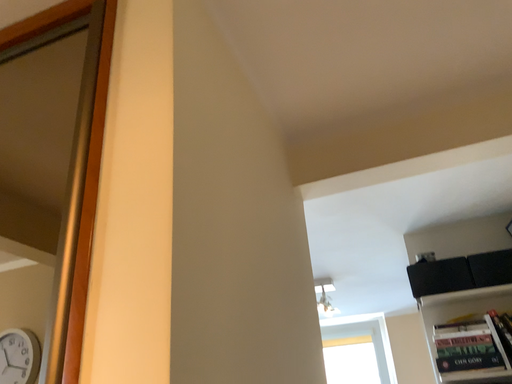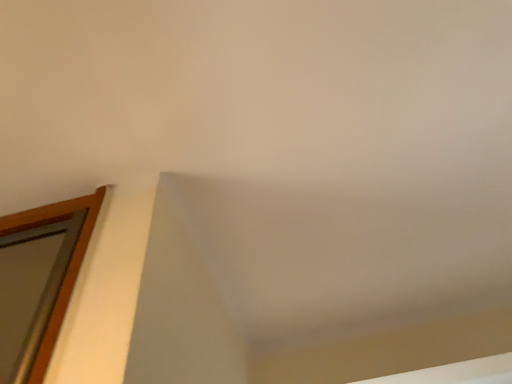
Question: Which way did the camera rotate in the video?

Choices:
 (A) rotated downward
 (B) rotated upward

Answer: (B)